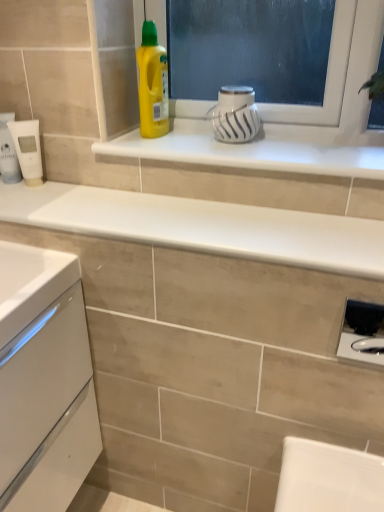
In order to click on free location in front of white glossy mug at upper center, the second appliance from the back in this screenshot , I will do `click(249, 151)`.